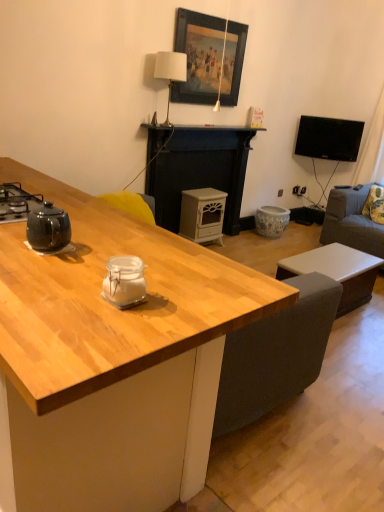
This screenshot has width=384, height=512. Find the location of `free space to the left of clear glass jar at center, marked as the 2th appliance in a top-to-bottom arrangement`. free space to the left of clear glass jar at center, marked as the 2th appliance in a top-to-bottom arrangement is located at coordinates (64, 293).